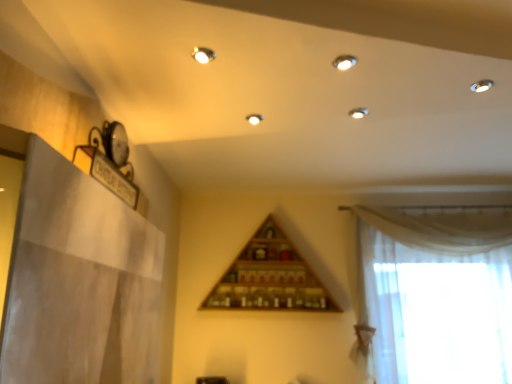
Question: From the image's perspective, is white sheer curtain at right located beneath wooden triangle at center?

Choices:
 (A) no
 (B) yes

Answer: (B)

Question: Can you confirm if white sheer curtain at right is bigger than wooden triangle at center?

Choices:
 (A) yes
 (B) no

Answer: (A)

Question: Is white sheer curtain at right positioned in front of wooden triangle at center?

Choices:
 (A) yes
 (B) no

Answer: (A)

Question: Is white sheer curtain at right not near wooden triangle at center?

Choices:
 (A) no
 (B) yes

Answer: (A)

Question: Is white sheer curtain at right at the right side of wooden triangle at center?

Choices:
 (A) yes
 (B) no

Answer: (A)

Question: From the image's perspective, does white sheer curtain at right appear higher than wooden triangle at center?

Choices:
 (A) yes
 (B) no

Answer: (B)

Question: From a real-world perspective, is wooden triangle at center physically below white sheer curtain at right?

Choices:
 (A) no
 (B) yes

Answer: (A)

Question: Can you confirm if wooden triangle at center is shorter than white sheer curtain at right?

Choices:
 (A) no
 (B) yes

Answer: (B)

Question: Is the surface of wooden triangle at center in direct contact with white sheer curtain at right?

Choices:
 (A) no
 (B) yes

Answer: (A)

Question: Considering the relative positions of wooden triangle at center and white sheer curtain at right in the image provided, is wooden triangle at center behind white sheer curtain at right?

Choices:
 (A) yes
 (B) no

Answer: (A)

Question: Considering the relative positions of wooden triangle at center and white sheer curtain at right in the image provided, is wooden triangle at center to the left of white sheer curtain at right from the viewer's perspective?

Choices:
 (A) no
 (B) yes

Answer: (B)

Question: Is wooden triangle at center surrounding white sheer curtain at right?

Choices:
 (A) no
 (B) yes

Answer: (A)

Question: Considering the positions of point click(485, 309) and point click(317, 279), is point click(485, 309) closer or farther from the camera than point click(317, 279)?

Choices:
 (A) closer
 (B) farther

Answer: (A)